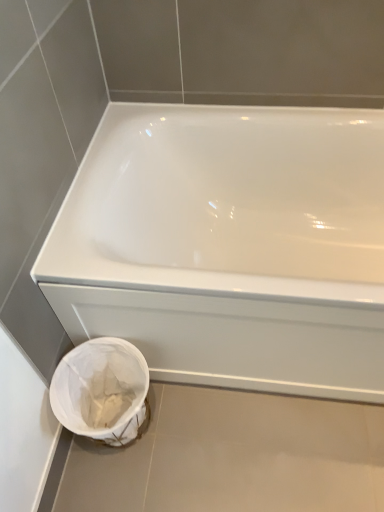
The image size is (384, 512). In order to click on white fabric bag at lower left in this screenshot , I will do `click(102, 391)`.

What do you see at coordinates (102, 391) in the screenshot? I see `white fabric bag at lower left` at bounding box center [102, 391].

The height and width of the screenshot is (512, 384). What do you see at coordinates (230, 246) in the screenshot?
I see `white glossy bathtub at center` at bounding box center [230, 246].

I want to click on white glossy bathtub at center, so click(230, 246).

Measure the distance between white glossy bathtub at center and camera.

33.75 inches.

Image resolution: width=384 pixels, height=512 pixels. Find the location of `white fabric bag at lower left`. white fabric bag at lower left is located at coordinates (102, 391).

Does white fabric bag at lower left appear on the left side of white glossy bathtub at center?

Correct, you'll find white fabric bag at lower left to the left of white glossy bathtub at center.

Does white fabric bag at lower left lie in front of white glossy bathtub at center?

No, white fabric bag at lower left is further to the viewer.

From the picture: Which is closer, (113, 367) or (288, 134)?

Point (113, 367) is closer to the camera than point (288, 134).

From the image's perspective, would you say white fabric bag at lower left is positioned over white glossy bathtub at center?

No.

From a real-world perspective, who is located lower, white fabric bag at lower left or white glossy bathtub at center?

From a 3D spatial view, white fabric bag at lower left is below.

Considering the relative sizes of white fabric bag at lower left and white glossy bathtub at center in the image provided, is white fabric bag at lower left thinner than white glossy bathtub at center?

Indeed, white fabric bag at lower left has a lesser width compared to white glossy bathtub at center.

Considering the relative sizes of white fabric bag at lower left and white glossy bathtub at center in the image provided, is white fabric bag at lower left shorter than white glossy bathtub at center?

Yes, white fabric bag at lower left is shorter than white glossy bathtub at center.

Does white fabric bag at lower left have a smaller size compared to white glossy bathtub at center?

Yes, white fabric bag at lower left is smaller than white glossy bathtub at center.

Is white fabric bag at lower left positioned beyond the bounds of white glossy bathtub at center?

Yes, white fabric bag at lower left is not within white glossy bathtub at center.

Does white fabric bag at lower left touch white glossy bathtub at center?

No, white fabric bag at lower left is not beside white glossy bathtub at center.

Is white fabric bag at lower left looking in the opposite direction of white glossy bathtub at center?

Yes, white fabric bag at lower left is facing away from white glossy bathtub at center.

The width and height of the screenshot is (384, 512). In the image, there is a white glossy bathtub at center. In order to click on porcelain below it (from a real-world perspective) in this screenshot , I will do pos(102,391).

Does white glossy bathtub at center appear on the right side of white fabric bag at lower left?

Correct, you'll find white glossy bathtub at center to the right of white fabric bag at lower left.

Is the position of white glossy bathtub at center more distant than that of white fabric bag at lower left?

No, white glossy bathtub at center is in front of white fabric bag at lower left.

Is point (196, 148) behind point (121, 374)?

Yes.

From the image's perspective, between white glossy bathtub at center and white fabric bag at lower left, who is located below?

From the image's view, white fabric bag at lower left is below.

From a real-world perspective, is white glossy bathtub at center positioned under white fabric bag at lower left based on gravity?

Actually, white glossy bathtub at center is physically above white fabric bag at lower left in the real world.

Between white glossy bathtub at center and white fabric bag at lower left, which one has smaller width?

Thinner between the two is white fabric bag at lower left.

Considering the relative sizes of white glossy bathtub at center and white fabric bag at lower left in the image provided, is white glossy bathtub at center taller than white fabric bag at lower left?

Yes, white glossy bathtub at center is taller than white fabric bag at lower left.

Who is smaller, white glossy bathtub at center or white fabric bag at lower left?

white fabric bag at lower left.

Would you say white fabric bag at lower left is part of white glossy bathtub at center's contents?

No, white glossy bathtub at center does not contain white fabric bag at lower left.

In the scene shown: Is white glossy bathtub at center with white fabric bag at lower left?

They are not placed beside each other.

Is white glossy bathtub at center turned away from white fabric bag at lower left?

No, white glossy bathtub at center's orientation is not away from white fabric bag at lower left.

Locate an element on the screen. This screenshot has height=512, width=384. porcelain behind the white glossy bathtub at center is located at coordinates (102, 391).

Image resolution: width=384 pixels, height=512 pixels. Find the location of `bathtub that is in front of the white fabric bag at lower left`. bathtub that is in front of the white fabric bag at lower left is located at coordinates point(230,246).

The width and height of the screenshot is (384, 512). I want to click on porcelain that appears on the left of white glossy bathtub at center, so click(x=102, y=391).